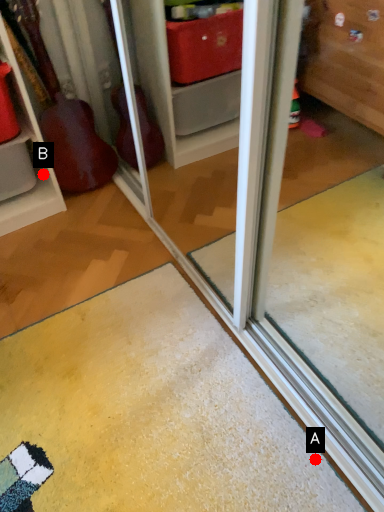
Question: Two points are circled on the image, labeled by A and B beside each circle. Which point is closer to the camera?

Choices:
 (A) A is closer
 (B) B is closer

Answer: (A)